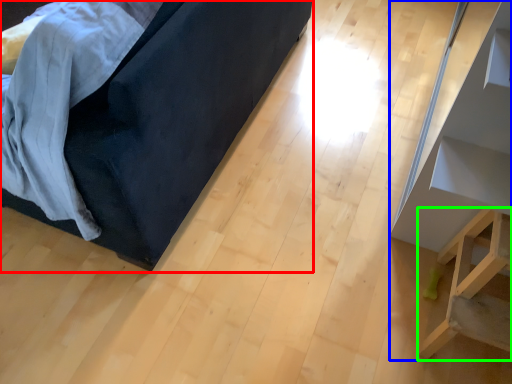
Question: Estimate the real-world distances between objects in this image. Which object is closer to furniture (highlighted by a red box), furniture (highlighted by a blue box) or furniture (highlighted by a green box)?

Choices:
 (A) furniture
 (B) furniture

Answer: (A)